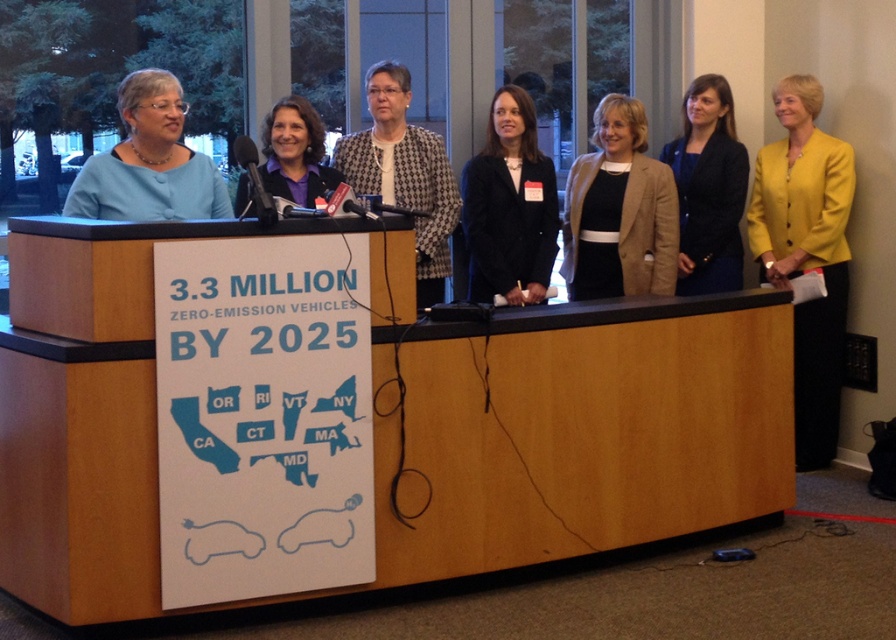
Question: Is wooden table at center further to camera compared to black matte blazer at center?

Choices:
 (A) yes
 (B) no

Answer: (B)

Question: From the image, what is the correct spatial relationship of tan leather blazer at center in relation to black matte blazer at center?

Choices:
 (A) left
 (B) right

Answer: (B)

Question: Based on their relative distances, which object is farther from the houndstooth-patterned blazer at center?

Choices:
 (A) matte blue blouse at center
 (B) wooden table at center
 (C) matte black blazer at center

Answer: (C)

Question: Can you confirm if yellow fabric jacket at right is positioned to the right of houndstooth-patterned blazer at center?

Choices:
 (A) yes
 (B) no

Answer: (A)

Question: Which object is positioned farthest from the matte purple blouse at center?

Choices:
 (A) houndstooth-patterned blazer at center
 (B) matte black blazer at center
 (C) yellow fabric jacket at right

Answer: (C)

Question: Which of the following is the closest to the observer?

Choices:
 (A) (610, 438)
 (B) (162, 156)
 (C) (397, 140)
 (D) (322, 150)

Answer: (B)